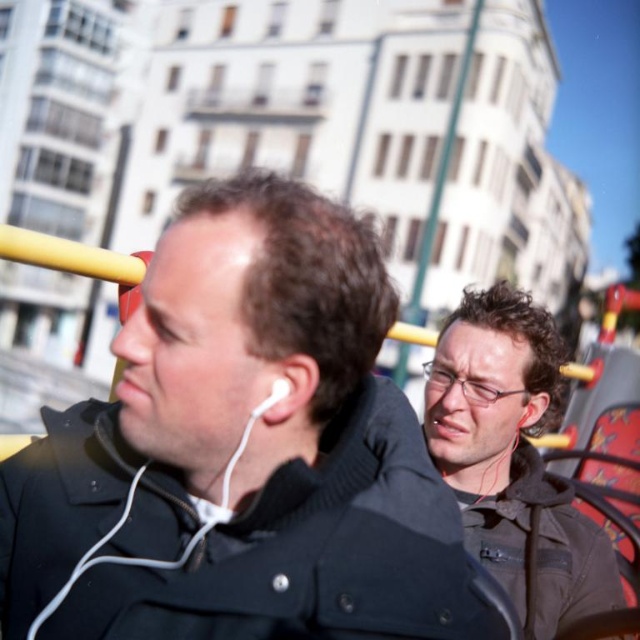
Does matte black jacket at center appear on the right side of white earbud at left?

Indeed, matte black jacket at center is positioned on the right side of white earbud at left.

Is point (532, 380) farther from camera compared to point (252, 412)?

Yes, it is.

Where is `matte black jacket at center`? The height and width of the screenshot is (640, 640). matte black jacket at center is located at coordinates (513, 460).

What do you see at coordinates (243, 452) in the screenshot? I see `black matte jacket at center` at bounding box center [243, 452].

Can you confirm if black matte jacket at center is shorter than red fabric chair at right?

Incorrect, black matte jacket at center's height does not fall short of red fabric chair at right's.

Which is in front, point (410, 573) or point (620, 502)?

Positioned in front is point (410, 573).

Where is `black matte jacket at center`? black matte jacket at center is located at coordinates (243, 452).

Can you confirm if red fabric chair at right is taller than white earbud at left?

Yes.

Can you confirm if red fabric chair at right is positioned to the left of white earbud at left?

Incorrect, red fabric chair at right is not on the left side of white earbud at left.

Does point (547, 461) come closer to viewer compared to point (272, 387)?

No, (547, 461) is behind (272, 387).

At what (x,y) coordinates should I click in order to perform the action: click on red fabric chair at right. Please return your answer as a coordinate pair (x, y). The height and width of the screenshot is (640, 640). Looking at the image, I should click on [x=611, y=484].